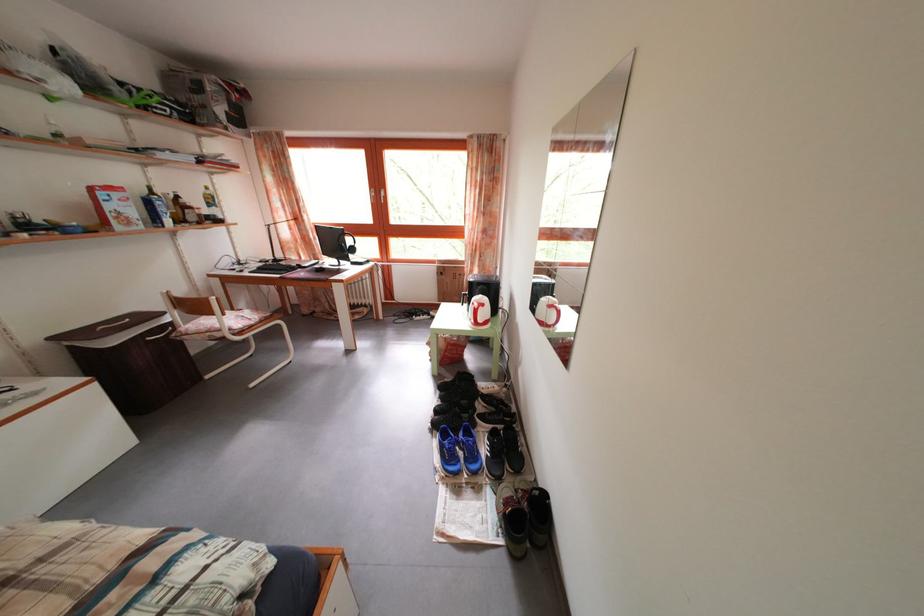
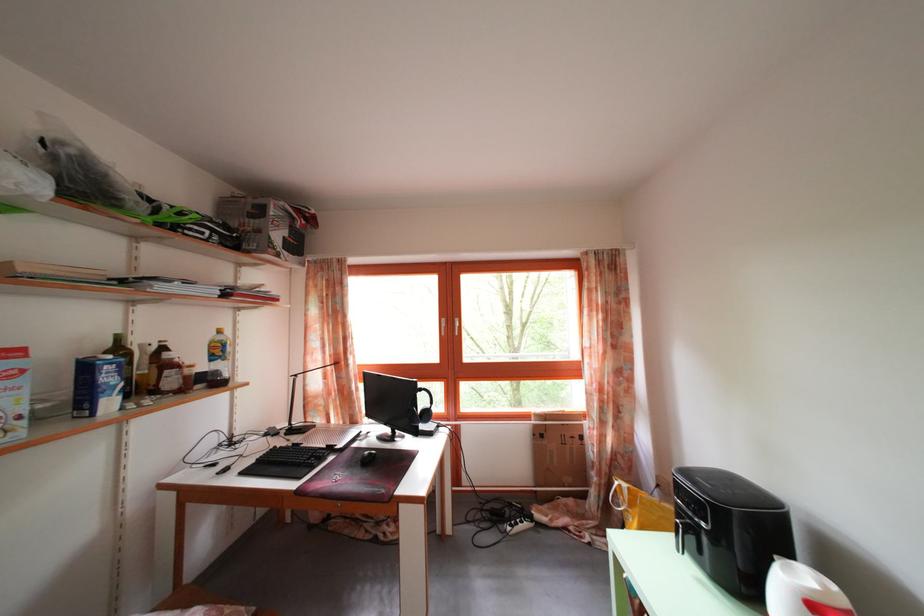
The point at (176, 229) is marked in the first image. Where is the corresponding point in the second image?

(117, 410)